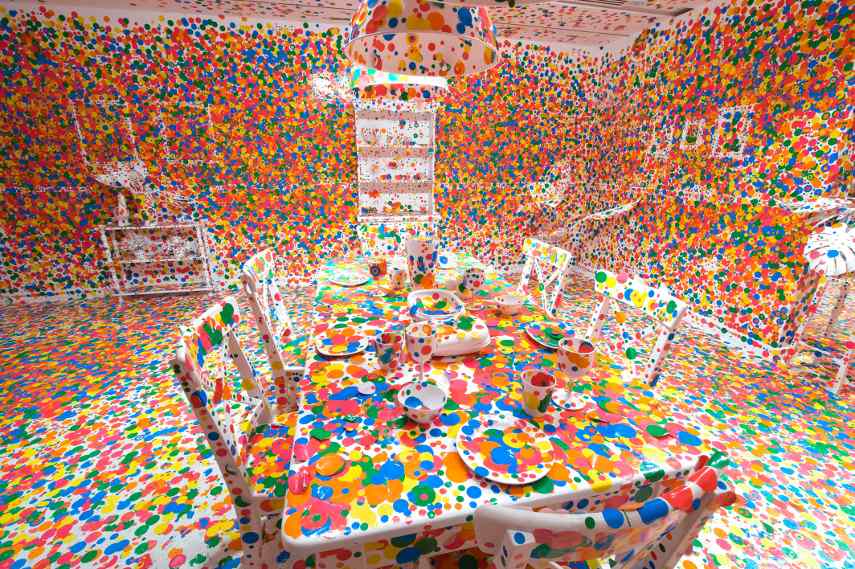
Where is `plate`? plate is located at coordinates (351, 343).